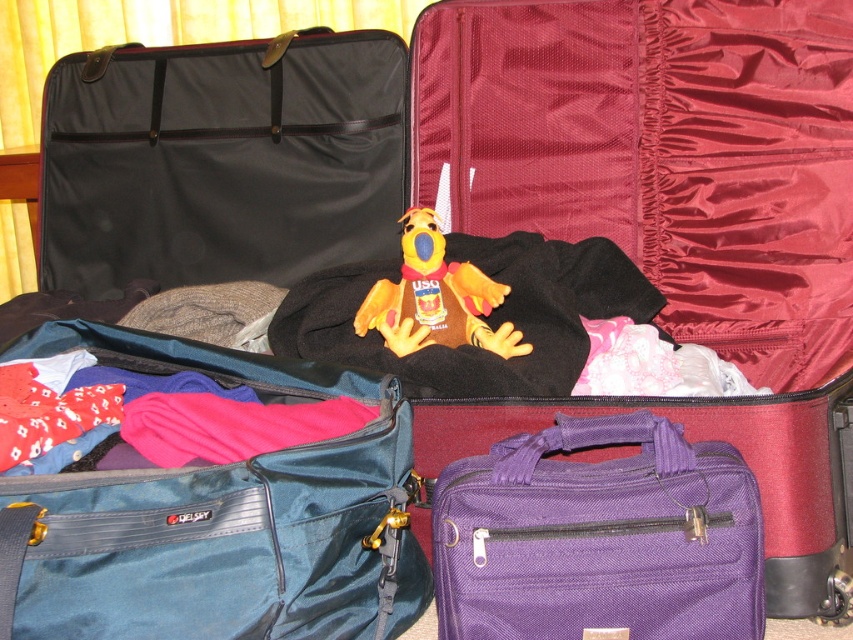
Question: Which point is closer to the camera?

Choices:
 (A) teal fabric bag at lower left
 (B) yellow plush toy at center

Answer: (A)

Question: Which of the following is the farthest from the observer?

Choices:
 (A) (399, 312)
 (B) (749, 625)

Answer: (A)

Question: Can you confirm if purple fabric briefcase at lower right is wider than yellow plush toy at center?

Choices:
 (A) no
 (B) yes

Answer: (B)

Question: Based on their relative distances, which object is nearer to the yellow plush toy at center?

Choices:
 (A) teal fabric bag at lower left
 (B) purple fabric briefcase at lower right

Answer: (A)

Question: In this image, where is teal fabric bag at lower left located relative to yellow plush toy at center?

Choices:
 (A) right
 (B) left

Answer: (B)

Question: Is purple fabric briefcase at lower right below yellow plush toy at center?

Choices:
 (A) yes
 (B) no

Answer: (A)